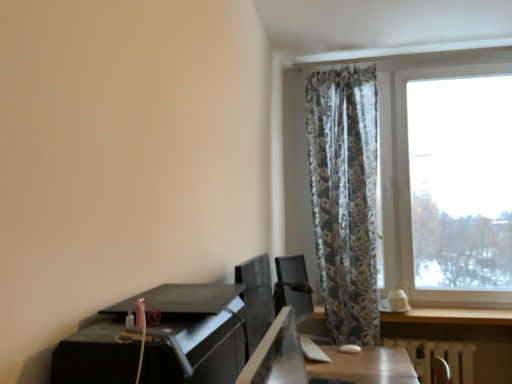
Question: Is transparent glass window at right next to white textured radiator at lower right?

Choices:
 (A) no
 (B) yes

Answer: (A)

Question: Considering the relative sizes of transparent glass window at right and white textured radiator at lower right in the image provided, is transparent glass window at right bigger than white textured radiator at lower right?

Choices:
 (A) yes
 (B) no

Answer: (B)

Question: Is transparent glass window at right shorter than white textured radiator at lower right?

Choices:
 (A) no
 (B) yes

Answer: (B)

Question: Is transparent glass window at right at the right side of white textured radiator at lower right?

Choices:
 (A) yes
 (B) no

Answer: (B)

Question: From a real-world perspective, is transparent glass window at right located beneath white textured radiator at lower right?

Choices:
 (A) yes
 (B) no

Answer: (B)

Question: Is transparent glass window at right at the left side of white textured radiator at lower right?

Choices:
 (A) no
 (B) yes

Answer: (B)

Question: Is satin black monitor at center at the right side of transparent glass window at right?

Choices:
 (A) yes
 (B) no

Answer: (B)

Question: Does satin black monitor at center come behind transparent glass window at right?

Choices:
 (A) no
 (B) yes

Answer: (A)

Question: Could you tell me if satin black monitor at center is facing transparent glass window at right?

Choices:
 (A) no
 (B) yes

Answer: (A)

Question: Considering the relative sizes of satin black monitor at center and transparent glass window at right in the image provided, is satin black monitor at center smaller than transparent glass window at right?

Choices:
 (A) no
 (B) yes

Answer: (B)

Question: Is satin black monitor at center directly adjacent to transparent glass window at right?

Choices:
 (A) yes
 (B) no

Answer: (B)

Question: Is the depth of satin black monitor at center less than that of transparent glass window at right?

Choices:
 (A) no
 (B) yes

Answer: (B)

Question: Is transparent glass window at right bigger than satin black monitor at center?

Choices:
 (A) no
 (B) yes

Answer: (B)